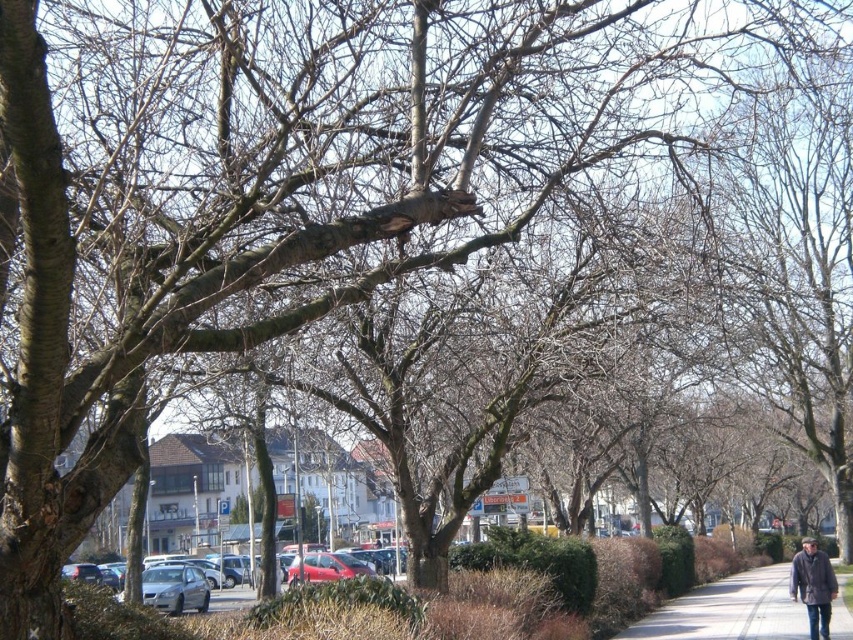
Does point (831, 620) come behind point (821, 566)?

That is True.

Identify the location of gray asphalt pavement at lower right. Image resolution: width=853 pixels, height=640 pixels. (728, 611).

This screenshot has height=640, width=853. Find the location of `gray asphalt pavement at lower right`. gray asphalt pavement at lower right is located at coordinates (728, 611).